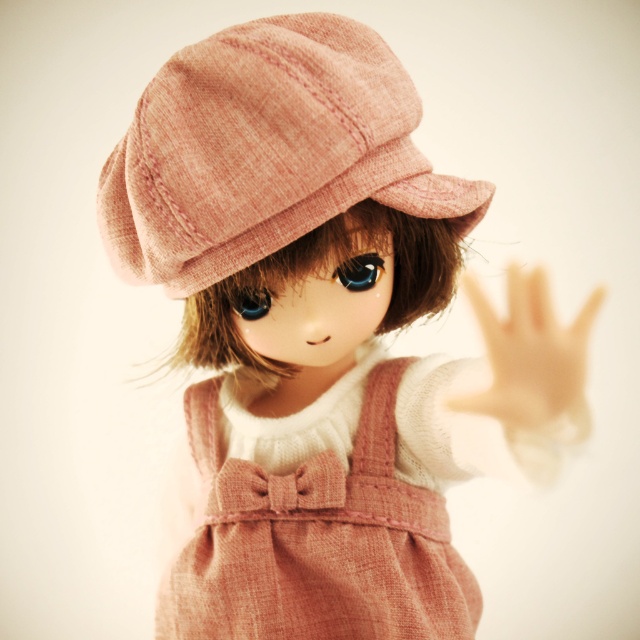
Question: Which object is closer to the camera taking this photo?

Choices:
 (A) rust-colored linen dress at center
 (B) pink woolen cap at upper center

Answer: (B)

Question: Is pink woolen cap at upper center to the left of rust-colored linen dress at center from the viewer's perspective?

Choices:
 (A) no
 (B) yes

Answer: (B)

Question: Can you confirm if pink woolen cap at upper center is thinner than rust-colored linen dress at center?

Choices:
 (A) yes
 (B) no

Answer: (B)

Question: Is pink woolen cap at upper center smaller than rust-colored linen dress at center?

Choices:
 (A) yes
 (B) no

Answer: (A)

Question: Which object appears farthest from the camera in this image?

Choices:
 (A) rust-colored linen dress at center
 (B) pink woolen cap at upper center

Answer: (A)

Question: Among these points, which one is farthest from the camera?

Choices:
 (A) (246, 129)
 (B) (538, 304)

Answer: (A)